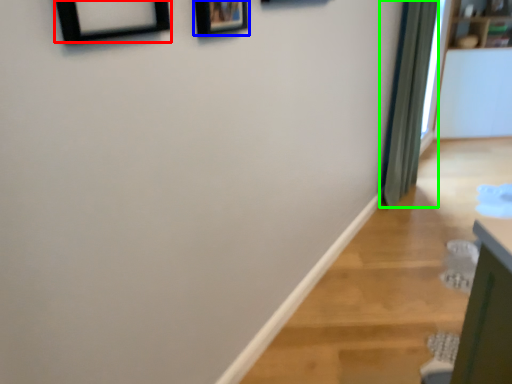
Question: Which is nearer to the picture frame (highlighted by a red box)? picture frame (highlighted by a blue box) or curtain (highlighted by a green box).

Choices:
 (A) picture frame
 (B) curtain

Answer: (A)